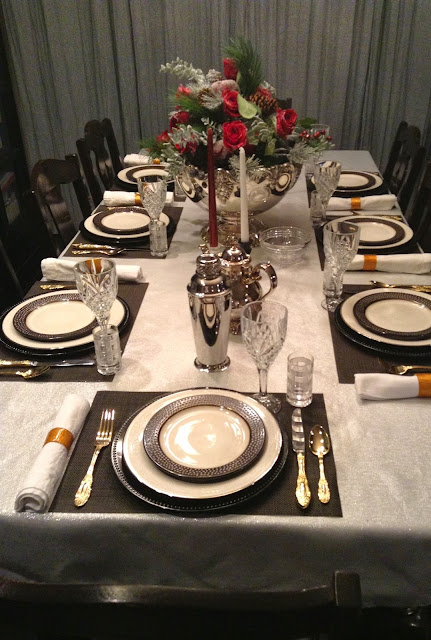
Where is `mats`? This screenshot has width=431, height=640. mats is located at coordinates (360, 367), (395, 258), (369, 189), (125, 182), (123, 244), (110, 330), (118, 458).